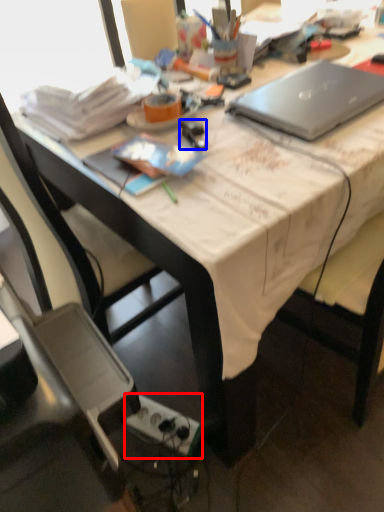
Question: Which point is further to the camera, power outlet (highlighted by a red box) or stationery (highlighted by a blue box)?

Choices:
 (A) power outlet
 (B) stationery

Answer: (A)